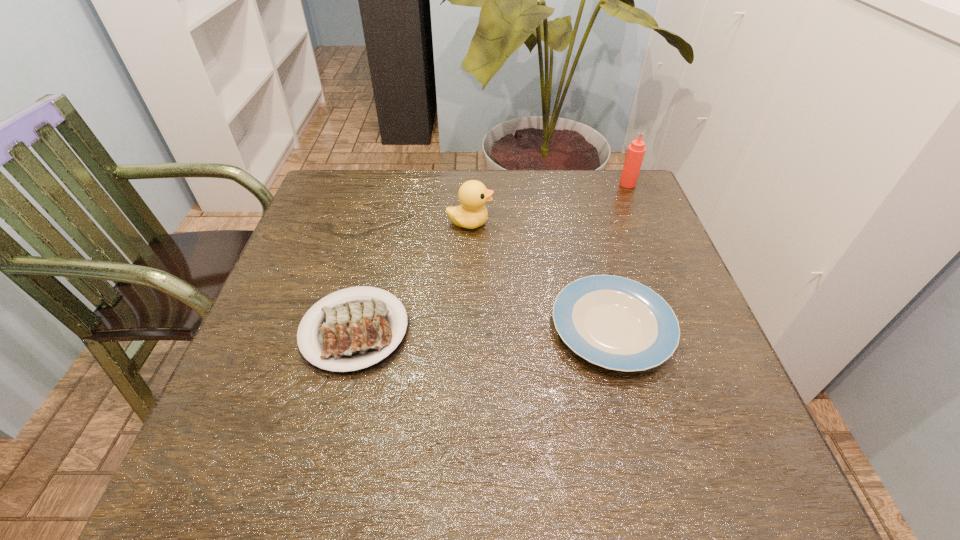
I want to click on vacant space at the near right corner of the desktop, so click(737, 490).

The height and width of the screenshot is (540, 960). In order to click on free area in between the farthest object and the leftmost object in this screenshot , I will do pyautogui.click(x=492, y=257).

This screenshot has width=960, height=540. I want to click on free area in between the second object from right to left and the second object from left to right, so click(x=540, y=275).

The height and width of the screenshot is (540, 960). Identify the location of vacant space that's between the duck and the tallest object. (549, 204).

Where is `vacant space in between the farthest object and the right plate`? vacant space in between the farthest object and the right plate is located at coordinates (620, 256).

At what (x,y) coordinates should I click in order to perform the action: click on free area in between the third nearest object and the tallest object. Please return your answer as a coordinate pair (x, y). This screenshot has height=540, width=960. Looking at the image, I should click on (549, 204).

Identify the location of blank region between the rightmost object and the right plate. (620, 256).

The height and width of the screenshot is (540, 960). What are the coordinates of `unoccupied position between the third object from left to right and the left plate` in the screenshot? It's located at (483, 329).

Where is `unoccupied position between the left plate and the farthest object`? The image size is (960, 540). unoccupied position between the left plate and the farthest object is located at coordinates (492, 257).

Locate an element on the screen. This screenshot has height=540, width=960. free space between the Tabasco sauce and the third object from left to right is located at coordinates (620, 256).